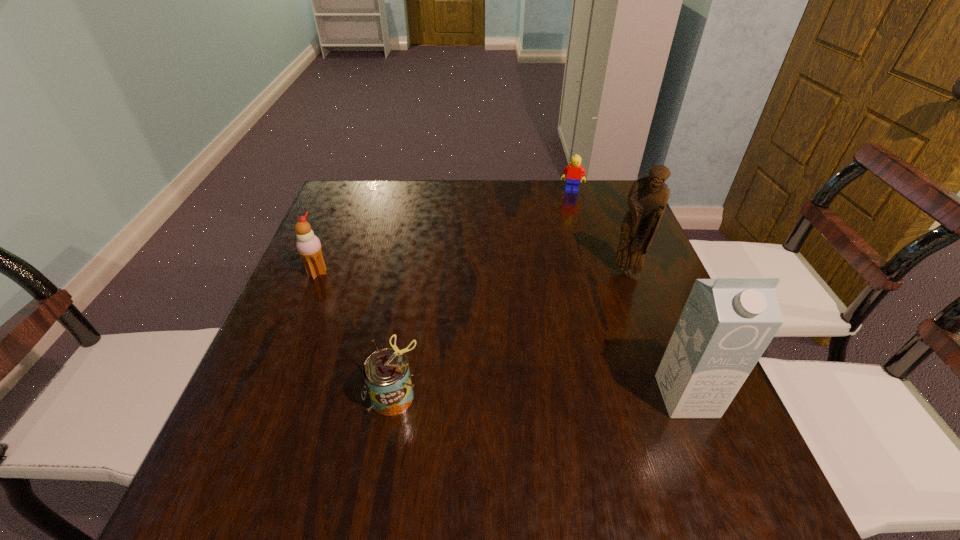
This screenshot has height=540, width=960. Find the location of `vacant spot on the desktop that is between the fourth tallest object and the carton and is positioned on the front-facing side of the figurine`. vacant spot on the desktop that is between the fourth tallest object and the carton and is positioned on the front-facing side of the figurine is located at coordinates (528, 396).

In order to click on free spot on the desktop that is between the second object from left to right and the carton and is positioned at the front with a straw on the leftmost object in this screenshot , I will do `click(571, 396)`.

Locate an element on the screen. vacant spot on the desktop that is between the can and the carton and is positioned on the front-facing side of the Lego is located at coordinates (540, 396).